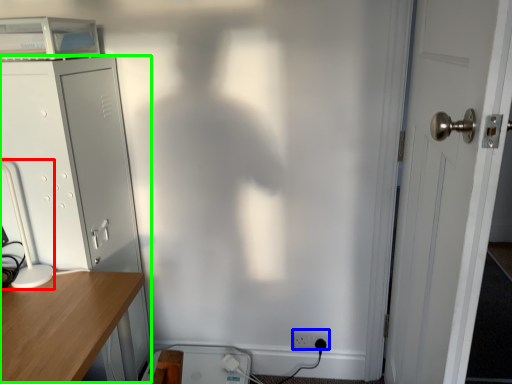
Question: Which is farther away from table lamp (highlighted by a red box)? electric outlet (highlighted by a blue box) or file cabinet (highlighted by a green box)?

Choices:
 (A) electric outlet
 (B) file cabinet

Answer: (A)